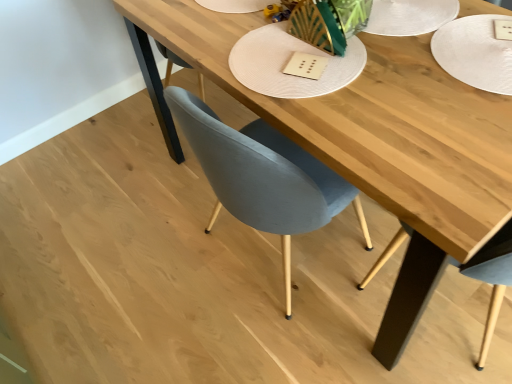
Measure the distance between point (490,77) and camera.

They are 1.08 meters apart.

Image resolution: width=512 pixels, height=384 pixels. In order to click on white textured placemat at upper right in this screenshot , I will do `click(477, 51)`.

Image resolution: width=512 pixels, height=384 pixels. What do you see at coordinates (477, 51) in the screenshot?
I see `white textured placemat at upper right` at bounding box center [477, 51].

Locate an element on the screen. white textured placemat at upper right is located at coordinates (477, 51).